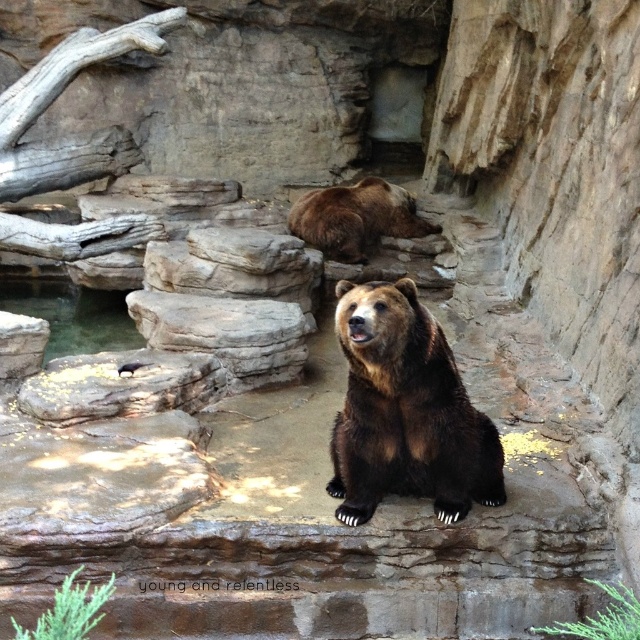
You are a wildlife photographer standing in a safe observation area. You want to take a photo of the brown furry bear at center from a distance that ensures safety while still capturing clear details. Given that the minimum safe distance for observing bears is 50 meters, can you safely take the photo from your current position?

The distance between you and the brown furry bear at center is 4.09 meters, which is much closer than the required 50 meters for safety. Therefore, you cannot safely take the photo from your current position and must move farther away to ensure safety.

You are a zookeeper observing two brown furry bears in the enclosure. The bears are labeled as the brown furry bear at center and the brown furry bear at upper center. Which bear has a smaller body size?

The brown furry bear at center is thinner than the brown furry bear at upper center, so the brown furry bear at center has a smaller body size.

You are a zookeeper observing the bears in their enclosure. You notice two brown furry bears. Which one is closer to you, the brown furry bear at center or the brown furry bear at upper center?

The brown furry bear at center is closer to you because it is positioned in front of the brown furry bear at upper center.